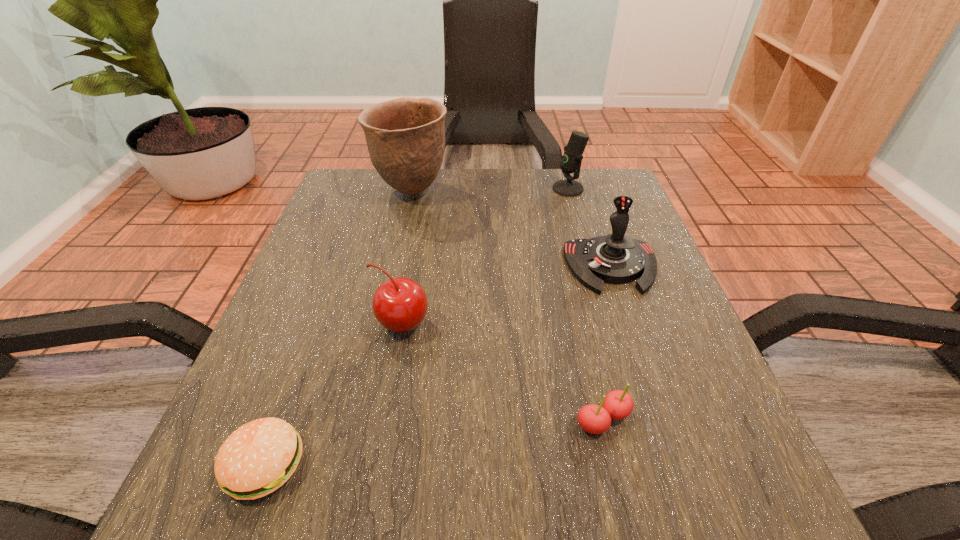
The width and height of the screenshot is (960, 540). What are the coordinates of `vacant space at the far right corner` in the screenshot? It's located at (604, 212).

Identify the location of free space between the pottery and the microphone. The width and height of the screenshot is (960, 540). (490, 190).

You are a GUI agent. You are given a task and a screenshot of the screen. Output one action in this format:
    pyautogui.click(x=<x>, y=<y>)
    Task: Click on the vacant space that's between the pottery and the shortest object
    This screenshot has width=960, height=540.
    Given the screenshot: What is the action you would take?
    pyautogui.click(x=338, y=328)

Find the location of a particular element. free space between the pottery and the microphone is located at coordinates (490, 190).

Find the location of a particular element. The height and width of the screenshot is (540, 960). empty space that is in between the tallest object and the joystick is located at coordinates (512, 229).

What are the coordinates of `free point between the pottery and the microphone` in the screenshot? It's located at (490, 190).

Where is `free space between the joystick and the pottery`? The image size is (960, 540). free space between the joystick and the pottery is located at coordinates (512, 229).

Find the location of a particular element. The height and width of the screenshot is (540, 960). free space between the farther cherry and the fourth nearest object is located at coordinates (506, 296).

In order to click on free space between the microphone and the tallest object in this screenshot , I will do `click(490, 190)`.

The width and height of the screenshot is (960, 540). I want to click on unoccupied area between the joystick and the tallest object, so click(512, 229).